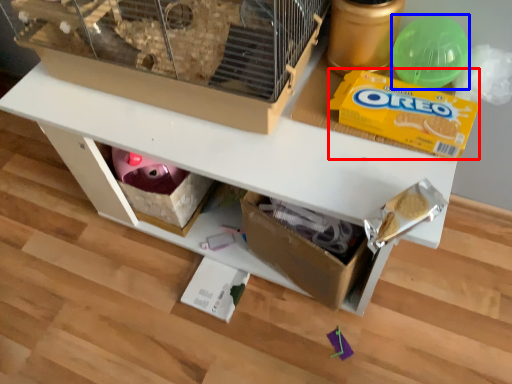
Question: Which of the following is the farthest to the observer, cereal (highlighted by a red box) or toy (highlighted by a blue box)?

Choices:
 (A) cereal
 (B) toy

Answer: (B)